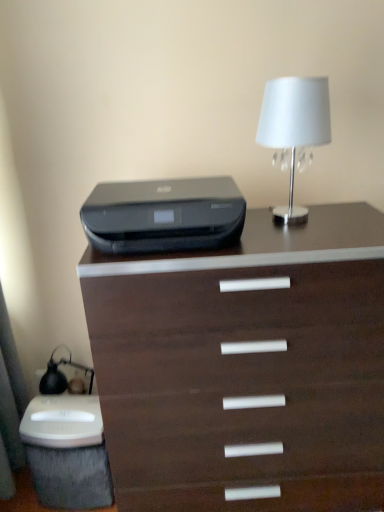
The image size is (384, 512). I want to click on dark wood chest of drawers at center, so tap(245, 366).

Find the location of a particular element. white fabric lampshade at upper right is located at coordinates (294, 128).

Find the location of a particular element. Image resolution: width=384 pixels, height=512 pixels. black plastic printer at center is located at coordinates (164, 215).

From the picture: Considering the sizes of black plastic printer at center and white fabric lampshade at upper right in the image, is black plastic printer at center wider or thinner than white fabric lampshade at upper right?

Clearly, black plastic printer at center has more width compared to white fabric lampshade at upper right.

From the image's perspective, which is below, black plastic printer at center or white fabric lampshade at upper right?

black plastic printer at center appears lower in the image.

Considering the relative sizes of black plastic printer at center and white fabric lampshade at upper right in the image provided, is black plastic printer at center bigger than white fabric lampshade at upper right?

Indeed, black plastic printer at center has a larger size compared to white fabric lampshade at upper right.

Considering the relative positions of black plastic printer at center and white fabric lampshade at upper right in the image provided, is black plastic printer at center to the left of white fabric lampshade at upper right from the viewer's perspective?

Yes, black plastic printer at center is to the left of white fabric lampshade at upper right.

Is the depth of white fabric lampshade at upper right less than that of dark wood chest of drawers at center?

No, it is not.

Looking at this image, considering the relative sizes of white fabric lampshade at upper right and dark wood chest of drawers at center in the image provided, is white fabric lampshade at upper right taller than dark wood chest of drawers at center?

In fact, white fabric lampshade at upper right may be shorter than dark wood chest of drawers at center.

Where is `printer on the left of dark wood chest of drawers at center`? printer on the left of dark wood chest of drawers at center is located at coordinates (164, 215).

Considering the positions of point (218, 493) and point (151, 223), is point (218, 493) closer or farther from the camera than point (151, 223)?

Point (218, 493) is farther from the camera than point (151, 223).

Which object is wider, dark wood chest of drawers at center or black plastic printer at center?

Wider between the two is dark wood chest of drawers at center.

Choose the correct answer: Is white fabric lampshade at upper right inside black plastic printer at center or outside it?

white fabric lampshade at upper right is not inside black plastic printer at center, it's outside.

From a real-world perspective, who is located lower, white fabric lampshade at upper right or black plastic printer at center?

black plastic printer at center.

Which is more to the left, white fabric lampshade at upper right or black plastic printer at center?

black plastic printer at center.

Is white fabric lampshade at upper right further to camera compared to black plastic printer at center?

Yes, white fabric lampshade at upper right is further from the camera.

From the image's perspective, is dark wood chest of drawers at center located above or below white fabric lampshade at upper right?

Clearly, from the image's perspective, dark wood chest of drawers at center is below white fabric lampshade at upper right.

Is dark wood chest of drawers at center oriented away from white fabric lampshade at upper right?

No, dark wood chest of drawers at center is not facing the opposite direction of white fabric lampshade at upper right.

Is dark wood chest of drawers at center shorter than white fabric lampshade at upper right?

No.

Can we say black plastic printer at center lies outside dark wood chest of drawers at center?

Yes, black plastic printer at center is outside of dark wood chest of drawers at center.

Considering the relative positions of black plastic printer at center and dark wood chest of drawers at center in the image provided, is black plastic printer at center to the right of dark wood chest of drawers at center from the viewer's perspective?

Incorrect, black plastic printer at center is not on the right side of dark wood chest of drawers at center.

Consider the image. Considering the relative sizes of black plastic printer at center and dark wood chest of drawers at center in the image provided, is black plastic printer at center taller than dark wood chest of drawers at center?

No, black plastic printer at center is not taller than dark wood chest of drawers at center.

The image size is (384, 512). Find the location of `printer below the white fabric lampshade at upper right (from the image's perspective)`. printer below the white fabric lampshade at upper right (from the image's perspective) is located at coordinates (164, 215).

I want to click on the chest of drawers below the white fabric lampshade at upper right (from a real-world perspective), so [x=245, y=366].

Looking at the image, which one is located further to white fabric lampshade at upper right, black plastic printer at center or dark wood chest of drawers at center?

dark wood chest of drawers at center.

Looking at the image, which one is located further to dark wood chest of drawers at center, white fabric lampshade at upper right or black plastic printer at center?

Based on the image, white fabric lampshade at upper right appears to be further to dark wood chest of drawers at center.

Which object lies further to the anchor point dark wood chest of drawers at center, black plastic printer at center or white fabric lampshade at upper right?

white fabric lampshade at upper right.

Considering their positions, is white fabric lampshade at upper right positioned further to black plastic printer at center than dark wood chest of drawers at center?

The object further to black plastic printer at center is dark wood chest of drawers at center.

When comparing their distances from white fabric lampshade at upper right, does dark wood chest of drawers at center or black plastic printer at center seem closer?

The object closer to white fabric lampshade at upper right is black plastic printer at center.

Based on their spatial positions, is dark wood chest of drawers at center or white fabric lampshade at upper right further from black plastic printer at center?

Among the two, dark wood chest of drawers at center is located further to black plastic printer at center.

You are a GUI agent. You are given a task and a screenshot of the screen. Output one action in this format:
    pyautogui.click(x=<x>, y=<y>)
    Task: Click on the printer between white fabric lampshade at upper right and dark wood chest of drawers at center in the vertical direction
    The width and height of the screenshot is (384, 512).
    Given the screenshot: What is the action you would take?
    pyautogui.click(x=164, y=215)